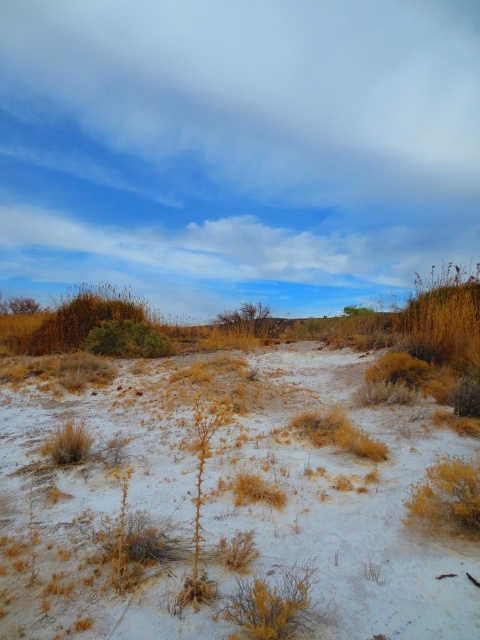
Question: Is white sandy soil at center wider than dry grass at center?

Choices:
 (A) no
 (B) yes

Answer: (B)

Question: Which point is closer to the camera?

Choices:
 (A) white sandy soil at center
 (B) dry grass at center

Answer: (A)

Question: Which point is farther to the camera?

Choices:
 (A) dry grass at center
 (B) white sandy soil at center

Answer: (A)

Question: Is white sandy soil at center thinner than dry grass at center?

Choices:
 (A) yes
 (B) no

Answer: (B)

Question: Among these objects, which one is nearest to the camera?

Choices:
 (A) dry grass at center
 (B) white sandy soil at center

Answer: (B)

Question: Does white sandy soil at center have a lesser width compared to dry grass at center?

Choices:
 (A) yes
 (B) no

Answer: (B)